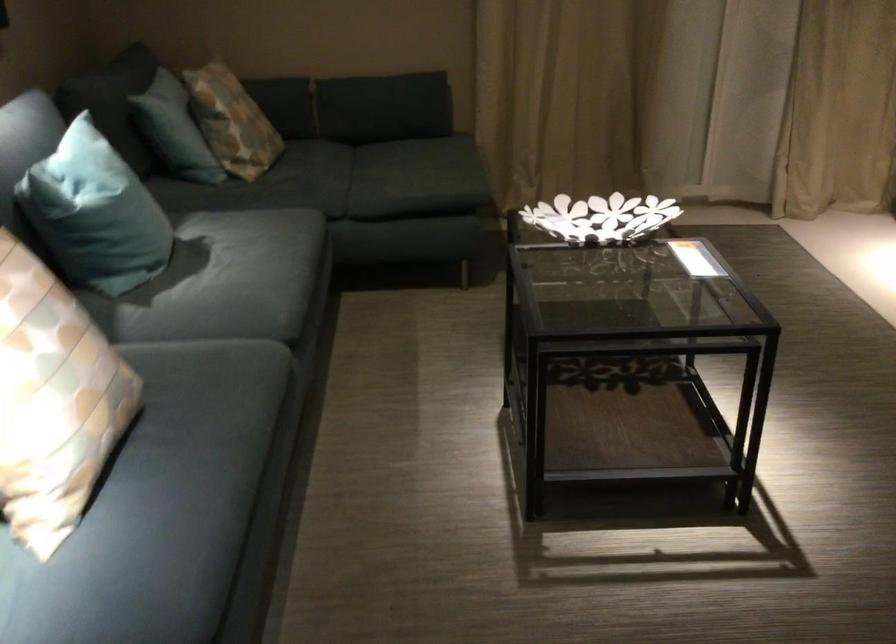
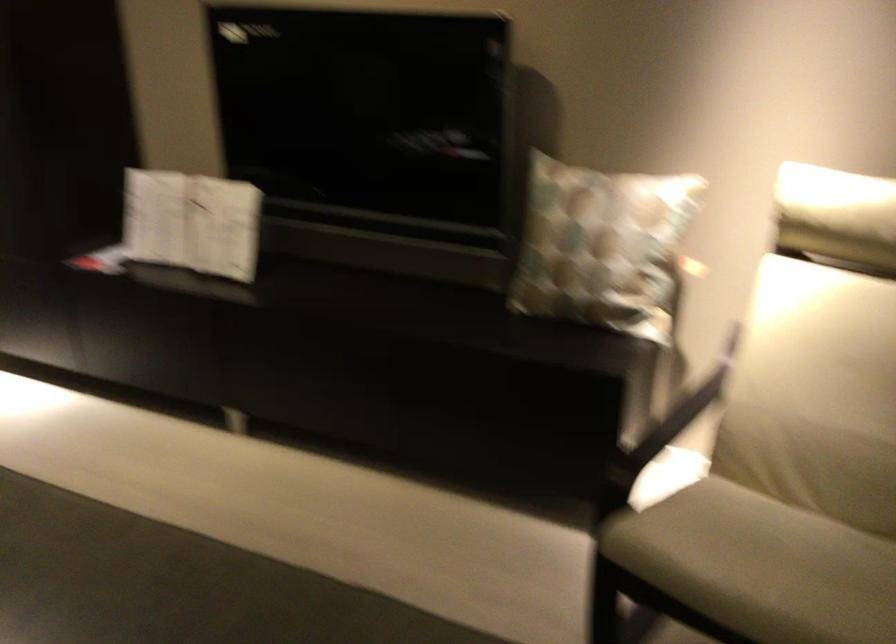
Question: How did the camera likely rotate?

Choices:
 (A) Left
 (B) Right
 (C) Up
 (D) Down

Answer: (B)